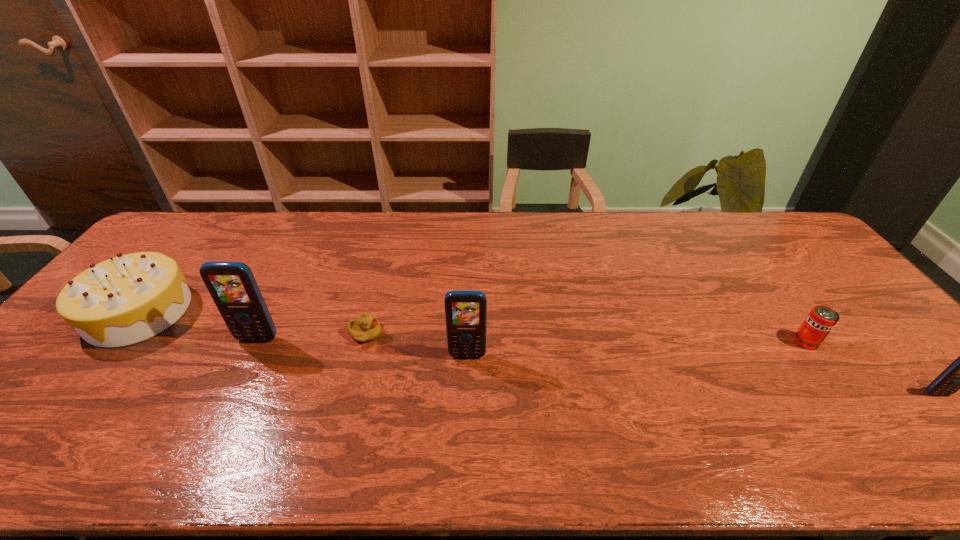
Find the location of a particular element. Image resolution: width=960 pixels, height=540 pixels. vacant area that lies between the duckling and the farthest cellular telephone is located at coordinates (312, 336).

Where is `free space that is in between the second tallest cellular telephone and the rightmost object`? free space that is in between the second tallest cellular telephone and the rightmost object is located at coordinates (702, 374).

Select which object is the third closest to the second nearest cellular telephone. Please provide its 2D coordinates. Your answer should be formatted as a tuple, i.e. [(x, y)], where the tuple contains the x and y coordinates of a point satisfying the conditions above.

[(124, 300)]

This screenshot has width=960, height=540. What are the coordinates of `object that is the second closest to the can` in the screenshot? It's located at (465, 310).

Identify the location of the closest cellular telephone to the can. Image resolution: width=960 pixels, height=540 pixels. (959, 375).

Select which cellular telephone is the second closest to the fifth object from left to right. Please provide its 2D coordinates. Your answer should be formatted as a tuple, i.e. [(x, y)], where the tuple contains the x and y coordinates of a point satisfying the conditions above.

[(465, 310)]

Where is `free space that satisfies the following two spatial constraints: 1. on the back side of the can; 2. on the front-facing side of the fourth object from right to left`? free space that satisfies the following two spatial constraints: 1. on the back side of the can; 2. on the front-facing side of the fourth object from right to left is located at coordinates (800, 334).

You are a GUI agent. You are given a task and a screenshot of the screen. Output one action in this format:
    pyautogui.click(x=<x>, y=<y>)
    Task: Click on the vacant space that satisfies the following two spatial constraints: 1. on the front-facing side of the duckling; 2. on the screen of the fifth object from right to left
    The height and width of the screenshot is (540, 960).
    Given the screenshot: What is the action you would take?
    click(x=364, y=339)